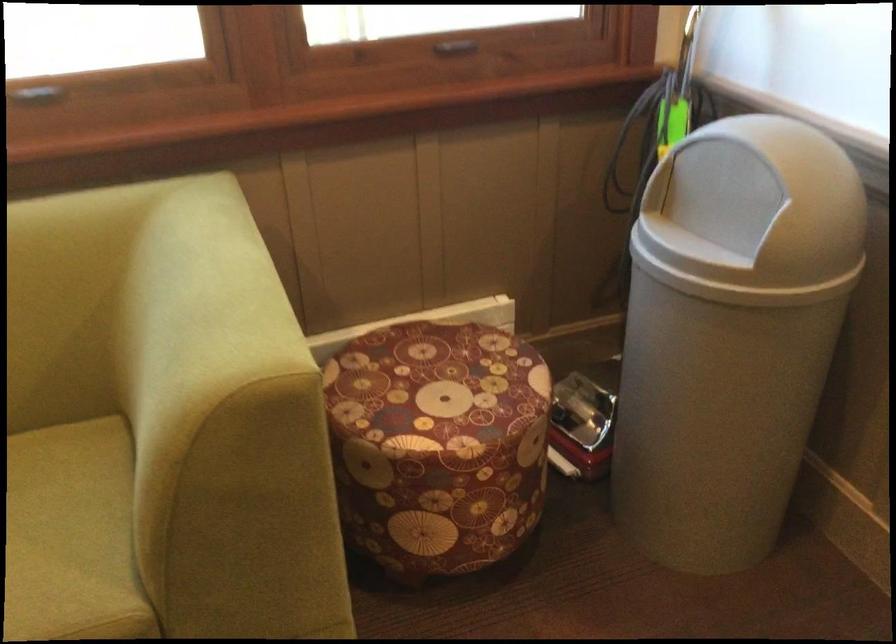
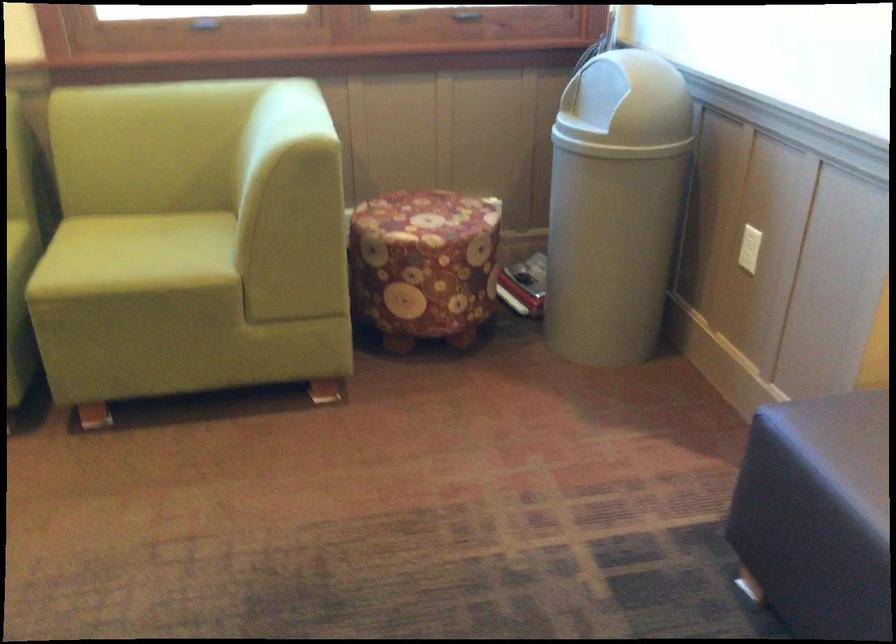
Consider the image. The images are taken continuously from a first-person perspective. In which direction are you moving?

The cameraman walked toward right, backward.